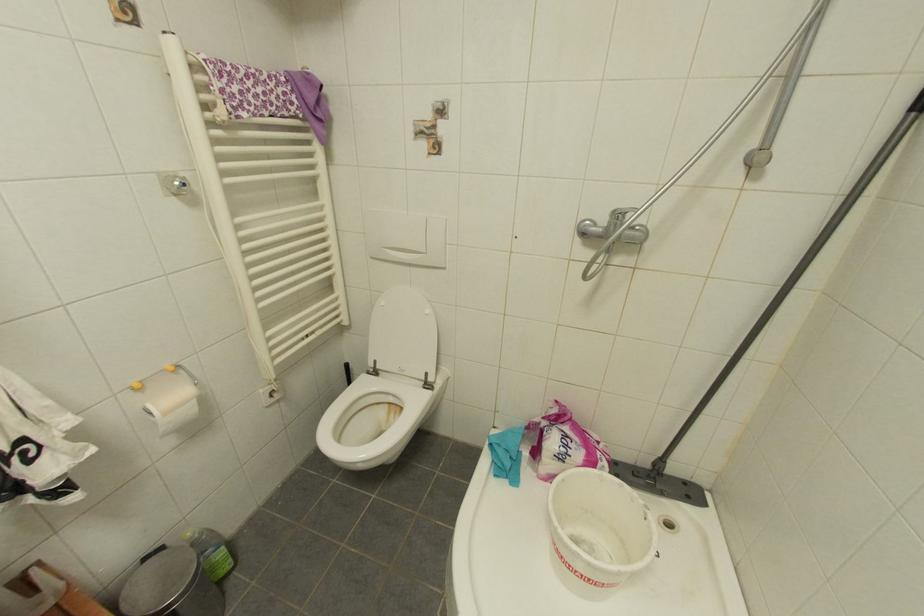
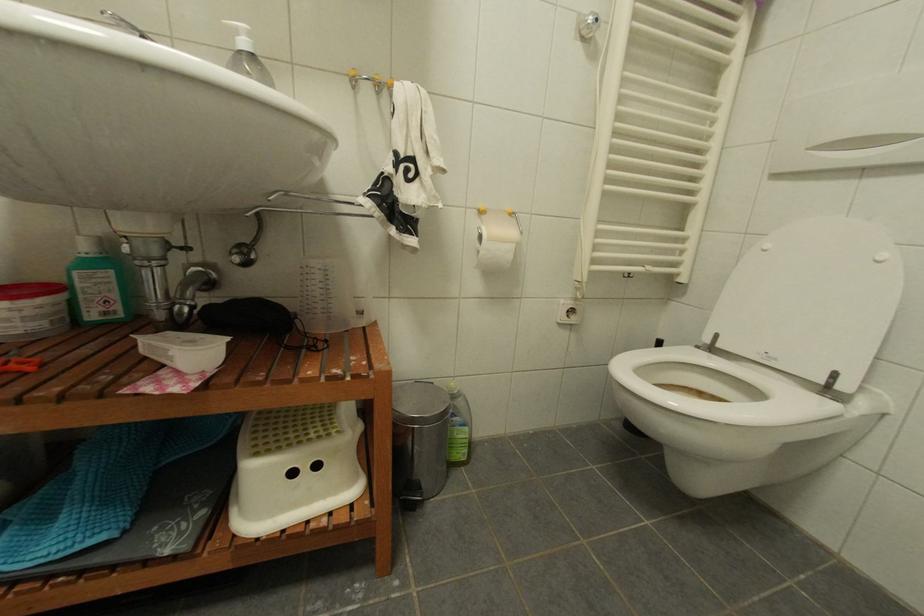
Question: The images are taken continuously from a first-person perspective. In which direction is your viewpoint rotating?

Choices:
 (A) Left
 (B) Right
 (C) Up
 (D) Down

Answer: (A)